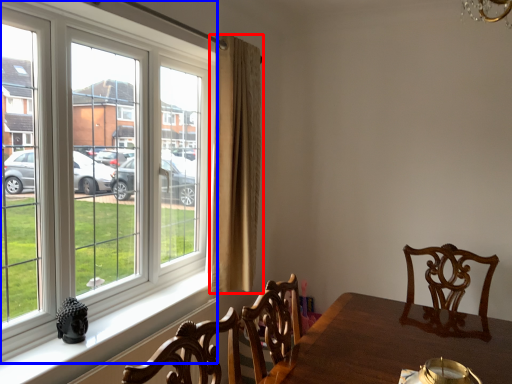
Question: Which of the following is the closest to the observer, curtain (highlighted by a red box) or window (highlighted by a blue box)?

Choices:
 (A) curtain
 (B) window

Answer: (B)